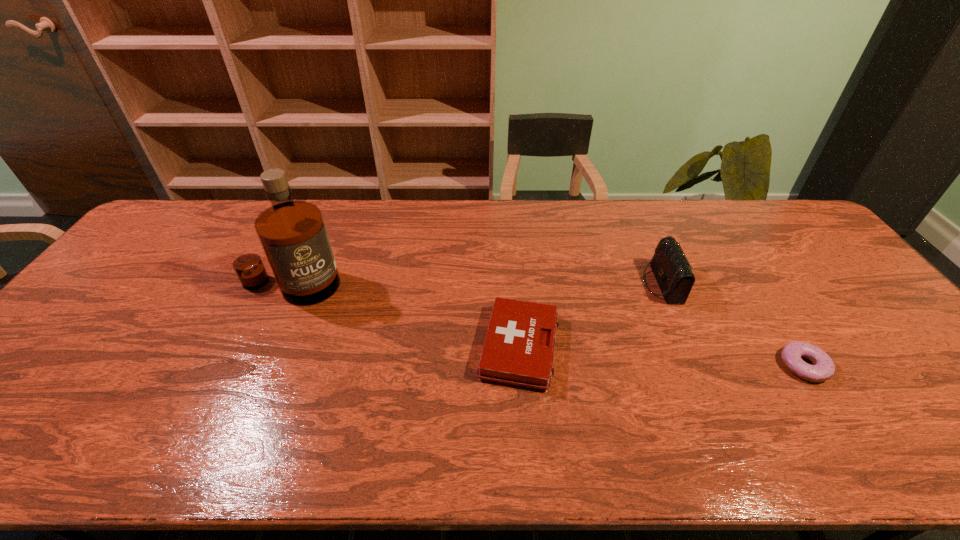
I want to click on the leftmost object, so click(292, 233).

Identify the location of the tallest object. (292, 233).

Identify the location of the third shortest object. The height and width of the screenshot is (540, 960). (672, 271).

Image resolution: width=960 pixels, height=540 pixels. Identify the location of the third object from left to right. (672, 271).

Find the location of a particular element. The width and height of the screenshot is (960, 540). the third object from right to left is located at coordinates 518,350.

Identify the location of the third tallest object. (518, 350).

Identify the location of the shortest object. The width and height of the screenshot is (960, 540). (823, 369).

Image resolution: width=960 pixels, height=540 pixels. In order to click on the rightmost object in this screenshot , I will do `click(823, 369)`.

Where is `vacant space situated 0.370m on the front label of the leftmost object`? Image resolution: width=960 pixels, height=540 pixels. vacant space situated 0.370m on the front label of the leftmost object is located at coordinates (225, 432).

Find the location of a particular element. vacant space located 0.280m on the front flap of the third shortest object is located at coordinates (549, 284).